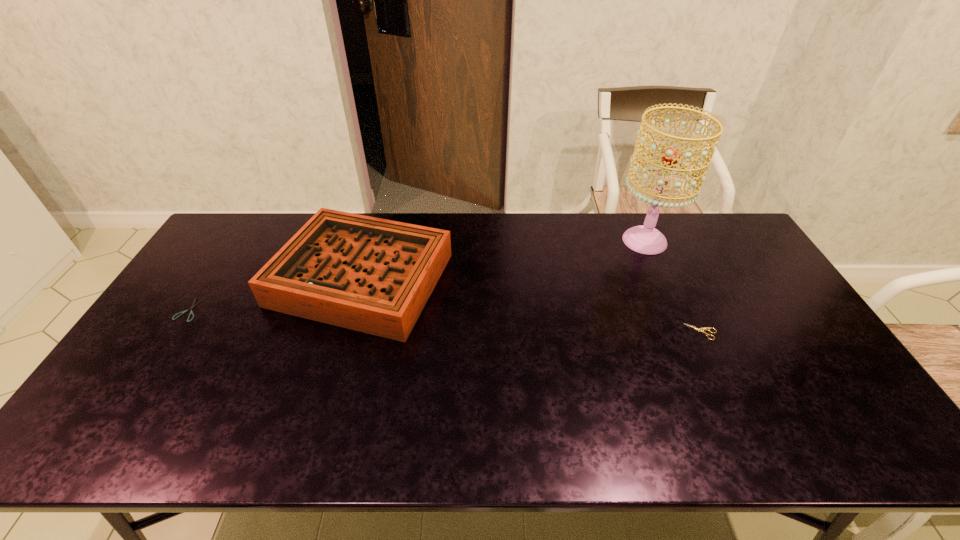
Locate an element on the screen. vacant area in the image that satisfies the following two spatial constraints: 1. on the front side of the nearer shears; 2. on the left side of the gameboard is located at coordinates (347, 332).

What are the coordinates of `free space in the image that satisfies the following two spatial constraints: 1. on the back side of the leftmost object; 2. on the right side of the gameboard` in the screenshot? It's located at pos(210,278).

At what (x,y) coordinates should I click in order to perform the action: click on free location that satisfies the following two spatial constraints: 1. on the back side of the lampshade; 2. on the right side of the shorter shears. Please return your answer as a coordinate pair (x, y). The image size is (960, 540). Looking at the image, I should click on (234, 241).